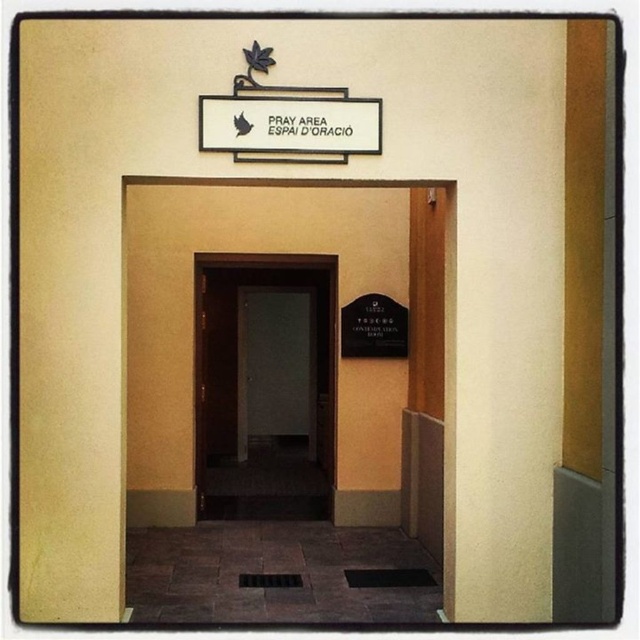
Question: Estimate the real-world distances between objects in this image. Which object is farther from the wooden door at center?

Choices:
 (A) dark wood door at center
 (B) white plastic sign at upper center

Answer: (A)

Question: Does dark wood door at center lie behind white plastic sign at upper center?

Choices:
 (A) yes
 (B) no

Answer: (A)

Question: Which point appears closest to the camera in this image?

Choices:
 (A) (227, 294)
 (B) (266, 129)

Answer: (B)

Question: Is wooden door at center in front of white plastic sign at upper center?

Choices:
 (A) yes
 (B) no

Answer: (B)

Question: Which point is closer to the camera taking this photo?

Choices:
 (A) (298, 401)
 (B) (317, 106)
 (C) (448, 211)

Answer: (B)

Question: Is dark wood door at center above white plastic sign at upper center?

Choices:
 (A) no
 (B) yes

Answer: (A)